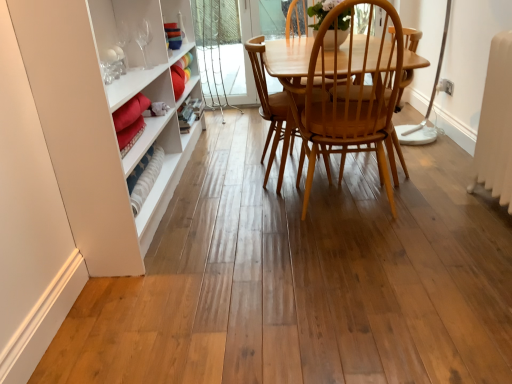
Question: Is light brown wood chair at center situated inside light brown wood chair at center or outside?

Choices:
 (A) outside
 (B) inside

Answer: (A)

Question: From the image's perspective, is light brown wood chair at center positioned above or below light brown wood chair at center?

Choices:
 (A) above
 (B) below

Answer: (B)

Question: Is point (280, 46) positioned closer to the camera than point (258, 44)?

Choices:
 (A) farther
 (B) closer

Answer: (B)

Question: From the image's perspective, relative to light brown wood chair at center, is light brown wood chair at center above or below?

Choices:
 (A) above
 (B) below

Answer: (A)

Question: Would you say light brown wood chair at center is to the left or to the right of light brown wood chair at center in the picture?

Choices:
 (A) right
 (B) left

Answer: (B)

Question: Do you think light brown wood chair at center is within light brown wood chair at center, or outside of it?

Choices:
 (A) outside
 (B) inside

Answer: (A)

Question: Looking at the image, does light brown wood chair at center seem bigger or smaller compared to light brown wood chair at center?

Choices:
 (A) big
 (B) small

Answer: (B)